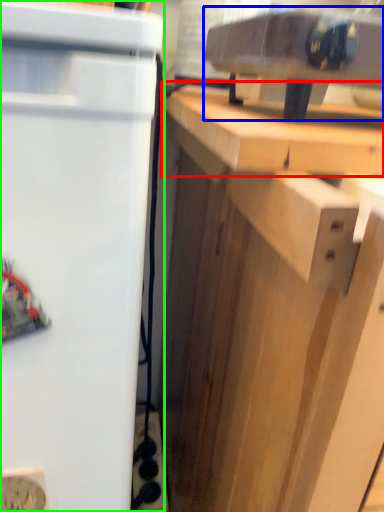
Question: Which is nearer to the counter top (highlighted by a red box)? appliance (highlighted by a blue box) or refrigerator (highlighted by a green box).

Choices:
 (A) appliance
 (B) refrigerator

Answer: (A)